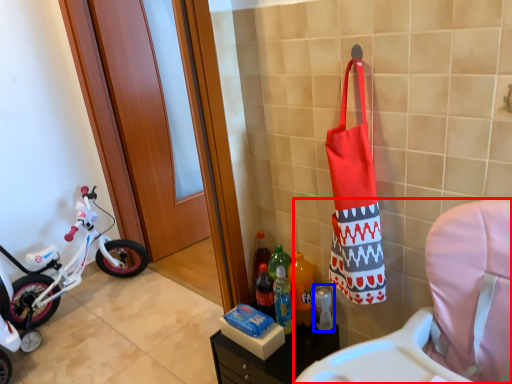
Question: Among these objects, which one is nearest to the camera, rocking chair (highlighted by a red box) or bottle (highlighted by a blue box)?

Choices:
 (A) rocking chair
 (B) bottle

Answer: (A)